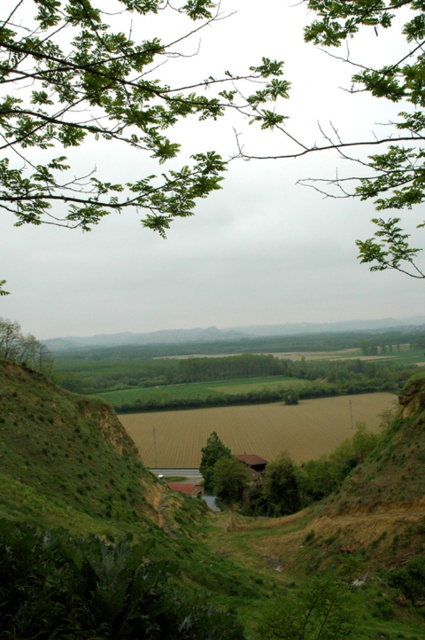
Where is `green leafy tree at left`? The width and height of the screenshot is (425, 640). green leafy tree at left is located at coordinates (22, 348).

Which of these two, green leafy tree at left or green matte tree at center, stands taller?

With more height is green leafy tree at left.

Between point (37, 355) and point (209, 483), which one is positioned behind?

Point (209, 483)

Where is `green leafy tree at left`? green leafy tree at left is located at coordinates (22, 348).